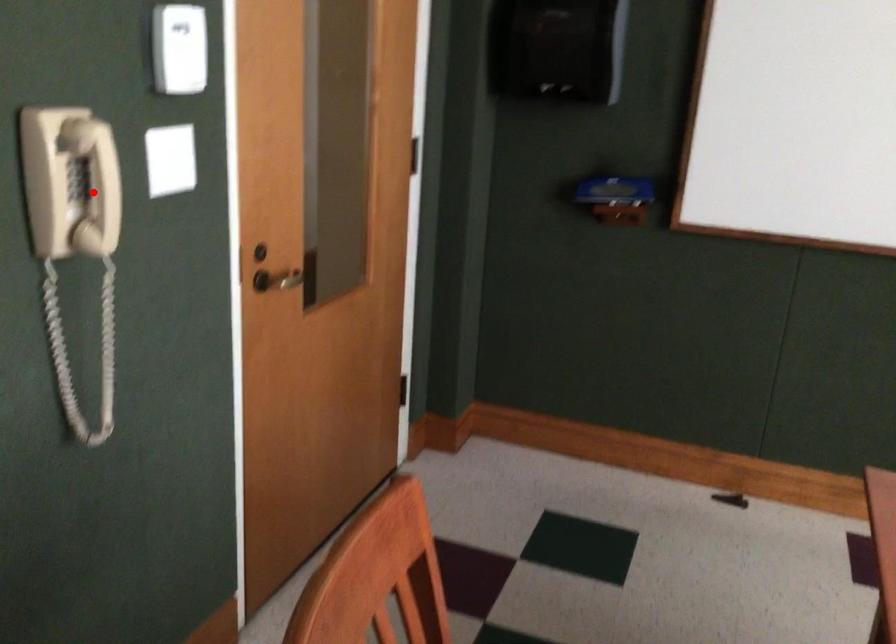
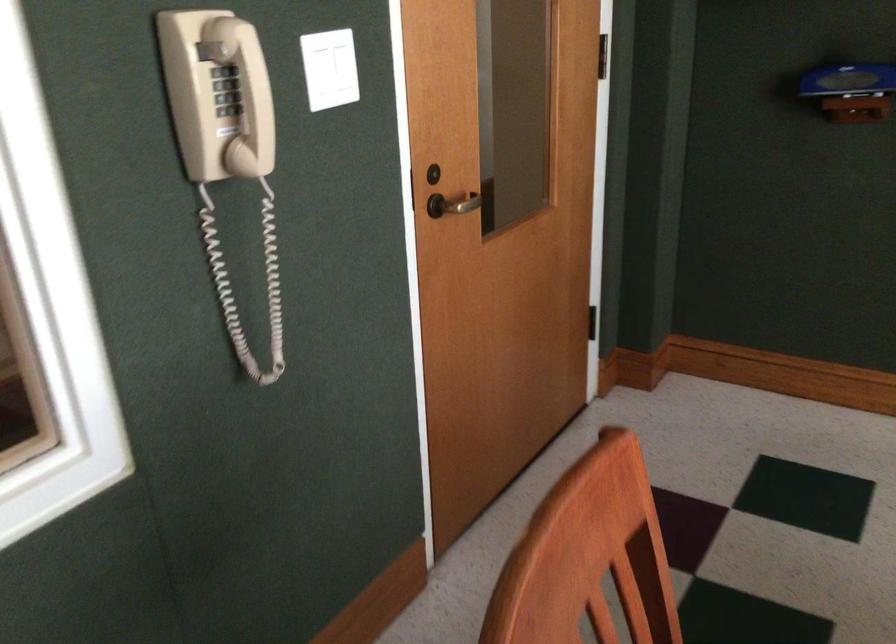
In the second image, find the point that corresponds to the highlighted location in the first image.

(226, 90)